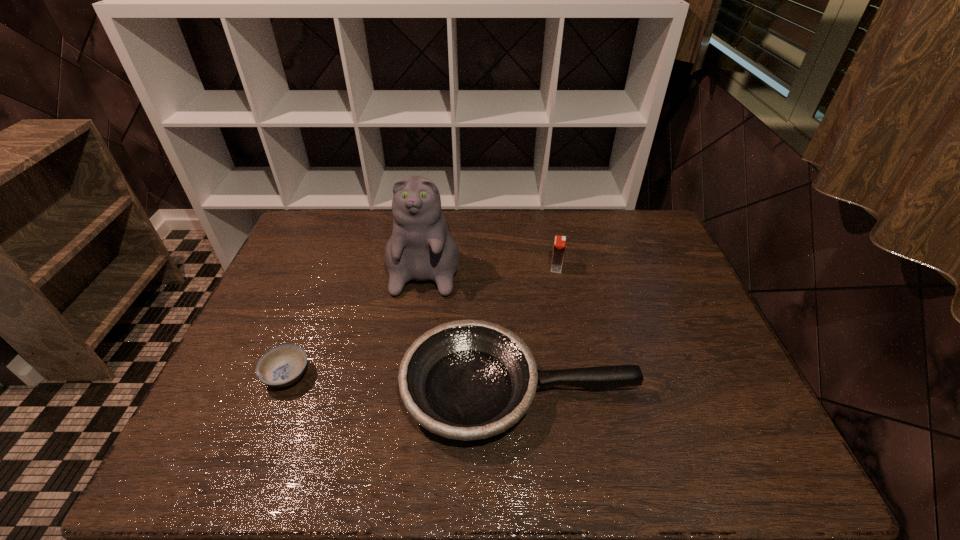
Find the location of a particular element. The image size is (960, 540). vacant area that lies between the bowl and the cat is located at coordinates (357, 315).

Locate an element on the screen. The height and width of the screenshot is (540, 960). free space between the tallest object and the orange juice is located at coordinates (492, 261).

What are the coordinates of `vacant space in between the tallest object and the third shortest object` in the screenshot? It's located at (492, 261).

Find the location of a particular element. The image size is (960, 540). unoccupied area between the tallest object and the shortest object is located at coordinates (357, 315).

This screenshot has height=540, width=960. Identify the location of blank region between the frying pan and the orange juice. (539, 328).

Point out which object is positioned as the second nearest to the bowl. Please provide its 2D coordinates. Your answer should be formatted as a tuple, i.e. [(x, y)], where the tuple contains the x and y coordinates of a point satisfying the conditions above.

[(421, 248)]

The width and height of the screenshot is (960, 540). Identify the location of object that is the nearest to the tallest object. click(466, 380).

At what (x,y) coordinates should I click in order to perform the action: click on vacant region that satisfies the following two spatial constraints: 1. on the face of the tallest object; 2. on the right side of the orange juice. Please return your answer as a coordinate pair (x, y). Looking at the image, I should click on (424, 267).

Where is `vacant space that satisfies the following two spatial constraints: 1. on the back side of the bowl; 2. on the left side of the orange juice`? The image size is (960, 540). vacant space that satisfies the following two spatial constraints: 1. on the back side of the bowl; 2. on the left side of the orange juice is located at coordinates (329, 267).